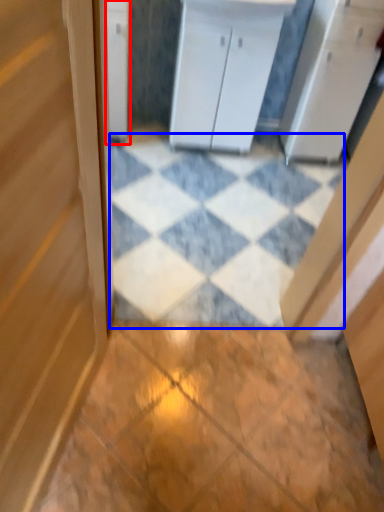
Question: Among these objects, which one is farthest to the camera, cabinetry (highlighted by a red box) or tile (highlighted by a blue box)?

Choices:
 (A) cabinetry
 (B) tile

Answer: (A)